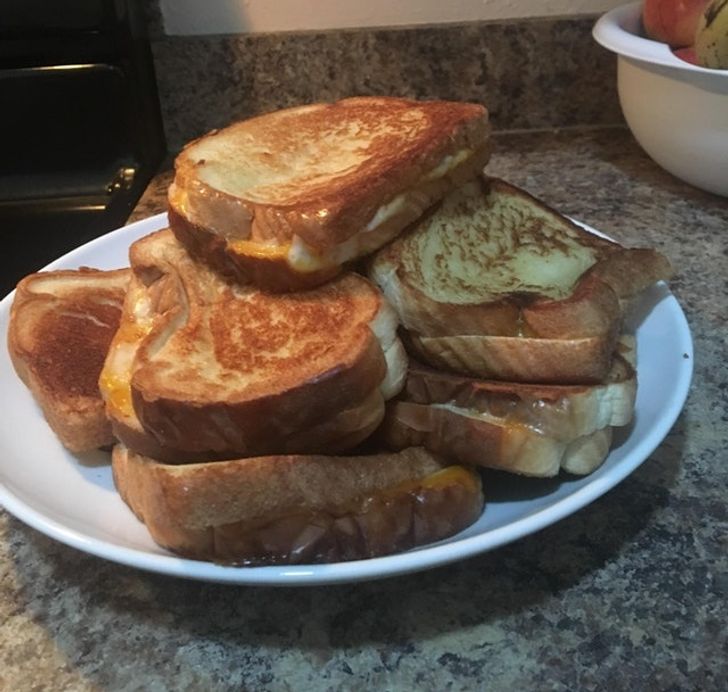
Image resolution: width=728 pixels, height=692 pixels. Find the location of `stove`. stove is located at coordinates pos(68,98).